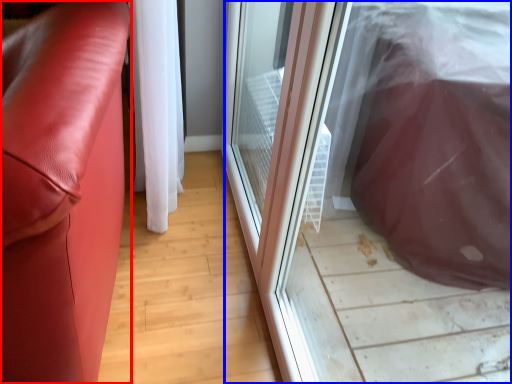
Question: Which object is closer to the camera taking this photo, furniture (highlighted by a red box) or screen door (highlighted by a blue box)?

Choices:
 (A) furniture
 (B) screen door

Answer: (B)